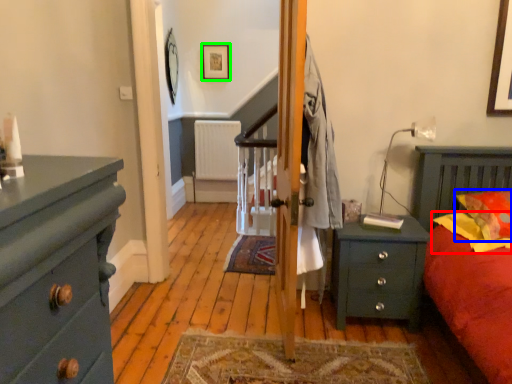
Question: Which object is positioned farthest from pillow (highlighted by a red box)? Select from pillow (highlighted by a blue box) and picture frame (highlighted by a green box).

Choices:
 (A) pillow
 (B) picture frame

Answer: (B)